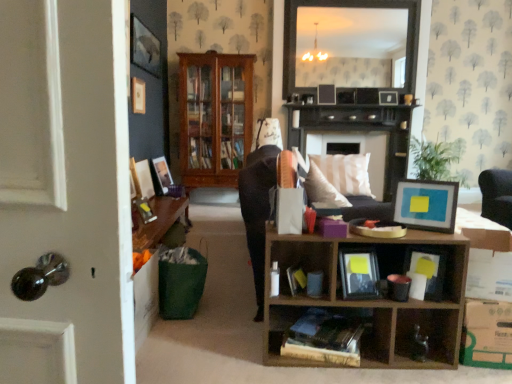
Question: Is matte wooden picture frame at left, the fifth picture frame positioned from the right, taller or shorter than dark wood fireplace at center?

Choices:
 (A) tall
 (B) short

Answer: (B)

Question: In terms of width, does matte wooden picture frame at left, positioned as the fourth picture frame in back-to-front order, look wider or thinner when compared to dark wood fireplace at center?

Choices:
 (A) wide
 (B) thin

Answer: (B)

Question: Which is nearer to the white cardboard box at lower right?

Choices:
 (A) matte black picture frame at upper center, arranged as the second picture frame when viewed from the right
 (B) dark wood fireplace at center
 (C) matte wooden picture frame at left, which is the fourth picture frame in front-to-back order
 (D) matte black picture frame at upper center, which ranks as the 1th picture frame in right-to-left order
 (E) matte black photo frame at center, the second book positioned from the left

Answer: (E)

Question: Which is farther from the dark wood fireplace at center?

Choices:
 (A) matte black mirror at upper center
 (B) matte wooden picture frame at left, the fifth picture frame positioned from the right
 (C) wooden picture frame at left, placed as the third picture frame when sorted from front to back
 (D) wooden cube at lower right
 (E) matte black book at lower right, the third book when ordered from left to right

Answer: (E)